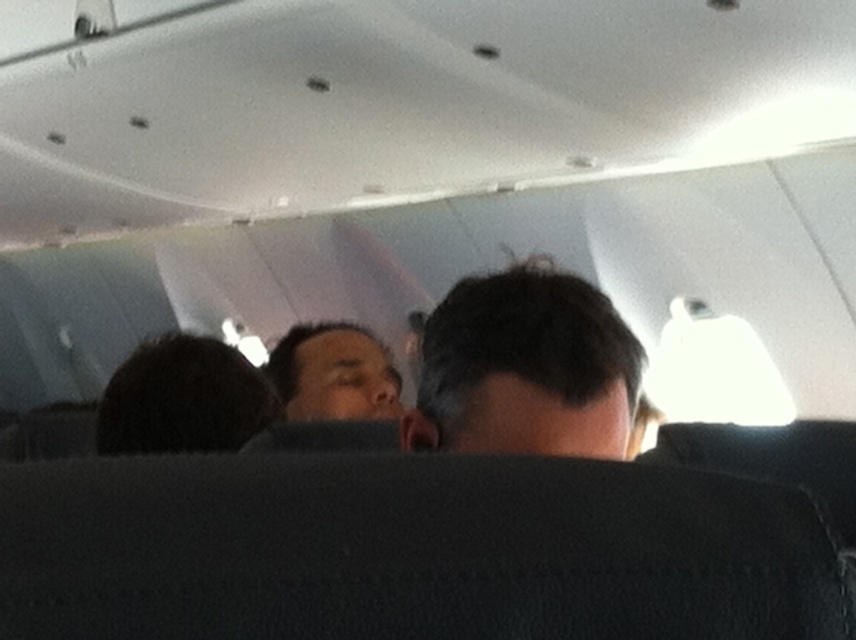
Question: Which point is farther to the camera?

Choices:
 (A) (337, 384)
 (B) (376, 401)
 (C) (601, 333)

Answer: (A)

Question: Can you confirm if dark brown hair at upper center is bigger than matte skin face at center?

Choices:
 (A) yes
 (B) no

Answer: (B)

Question: Is dark brown hair at upper center below matte skin face at center?

Choices:
 (A) yes
 (B) no

Answer: (B)

Question: Which of the following is the farthest from the observer?

Choices:
 (A) (559, 426)
 (B) (361, 381)
 (C) (394, 380)

Answer: (C)

Question: Which object appears farthest from the camera in this image?

Choices:
 (A) matte skin face at center
 (B) dark brown hair at upper center
 (C) matte skin nose at center

Answer: (C)

Question: Is dark brown hair at upper center above matte skin face at center?

Choices:
 (A) yes
 (B) no

Answer: (A)